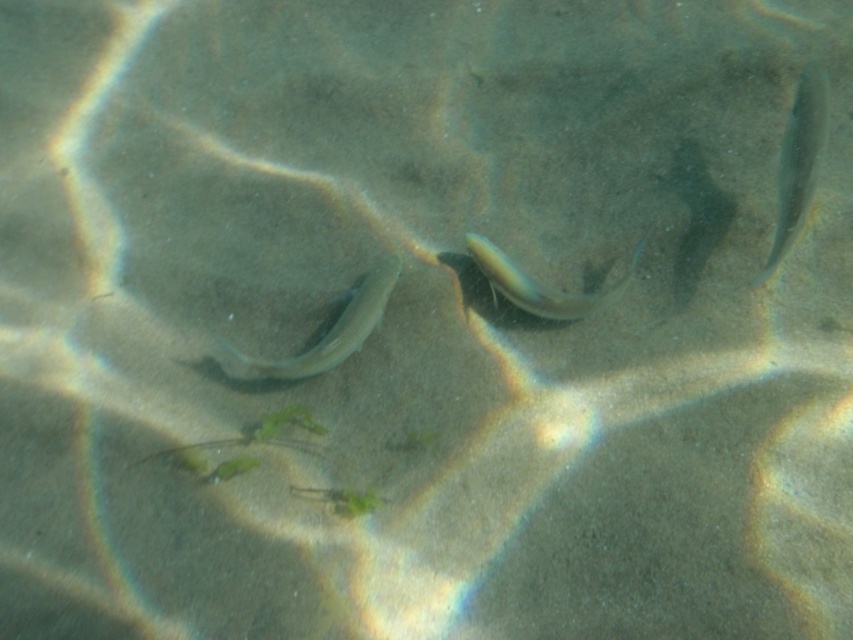
You are a marine biologist observing underwater. You need to locate the shiny silver fish at upper right. What are the coordinates where you can find it?

The shiny silver fish at upper right can be found at coordinates point (798, 161).

You are a diver swimming underwater and want to reach the point at coordinates point (354,300). However, there is an obstacle at point point (824,138). Will you encounter the obstacle before reaching your destination?

Yes, you will encounter the obstacle at point (824,138) before reaching point (354,300) because point (824,138) is in front of point (354,300).

You are a marine biologist observing the underwater scene. You need to place a 20 inch long measuring tape between the shiny silver fish at upper right and the translucent greenish fish at center. Will the measuring tape be long enough to reach both ends?

The distance between the shiny silver fish at upper right and the translucent greenish fish at center is 23.83 inches. Since the measuring tape is only 20 inches long, it will not be long enough to reach both ends.